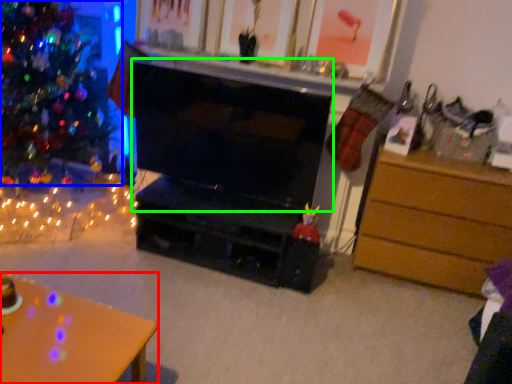
Question: Considering the real-world distances, which object is farthest from desk (highlighted by a red box)? christmas tree (highlighted by a blue box) or fireplace (highlighted by a green box)?

Choices:
 (A) christmas tree
 (B) fireplace

Answer: (A)